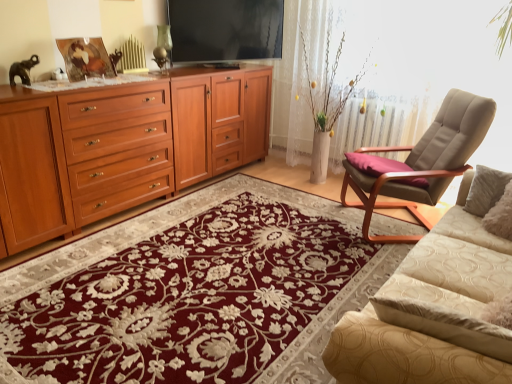
Question: Can you confirm if beige textured couch at lower right is shorter than metallic gold picture frame at upper left?

Choices:
 (A) no
 (B) yes

Answer: (A)

Question: From the image's perspective, does beige textured couch at lower right appear lower than metallic gold picture frame at upper left?

Choices:
 (A) yes
 (B) no

Answer: (A)

Question: Considering the relative sizes of beige textured couch at lower right and metallic gold picture frame at upper left in the image provided, is beige textured couch at lower right taller than metallic gold picture frame at upper left?

Choices:
 (A) yes
 (B) no

Answer: (A)

Question: Does beige textured couch at lower right have a lesser width compared to metallic gold picture frame at upper left?

Choices:
 (A) no
 (B) yes

Answer: (A)

Question: Is beige textured couch at lower right far from metallic gold picture frame at upper left?

Choices:
 (A) no
 (B) yes

Answer: (B)

Question: Would you say matte wood cabinet at left is inside or outside matte wood drawer at left?

Choices:
 (A) inside
 (B) outside

Answer: (B)

Question: Does point (218, 157) appear closer or farther from the camera than point (126, 127)?

Choices:
 (A) farther
 (B) closer

Answer: (A)

Question: From the image's perspective, is matte wood cabinet at left located above or below matte wood drawer at left?

Choices:
 (A) above
 (B) below

Answer: (A)

Question: Is matte wood cabinet at left in front of or behind matte wood drawer at left in the image?

Choices:
 (A) behind
 (B) front

Answer: (A)

Question: Considering the positions of point (145, 271) and point (461, 119), is point (145, 271) closer or farther from the camera than point (461, 119)?

Choices:
 (A) farther
 (B) closer

Answer: (B)

Question: Is floral carpet at center wider or thinner than beige fabric chair at right?

Choices:
 (A) thin
 (B) wide

Answer: (B)

Question: Is floral carpet at center in front of or behind beige fabric chair at right in the image?

Choices:
 (A) behind
 (B) front

Answer: (B)

Question: Is floral carpet at center to the left or to the right of beige fabric chair at right in the image?

Choices:
 (A) left
 (B) right

Answer: (A)

Question: Is beige fabric chair at right wider or thinner than floral carpet at center?

Choices:
 (A) wide
 (B) thin

Answer: (B)

Question: Is beige fabric chair at right to the left or to the right of floral carpet at center in the image?

Choices:
 (A) left
 (B) right

Answer: (B)